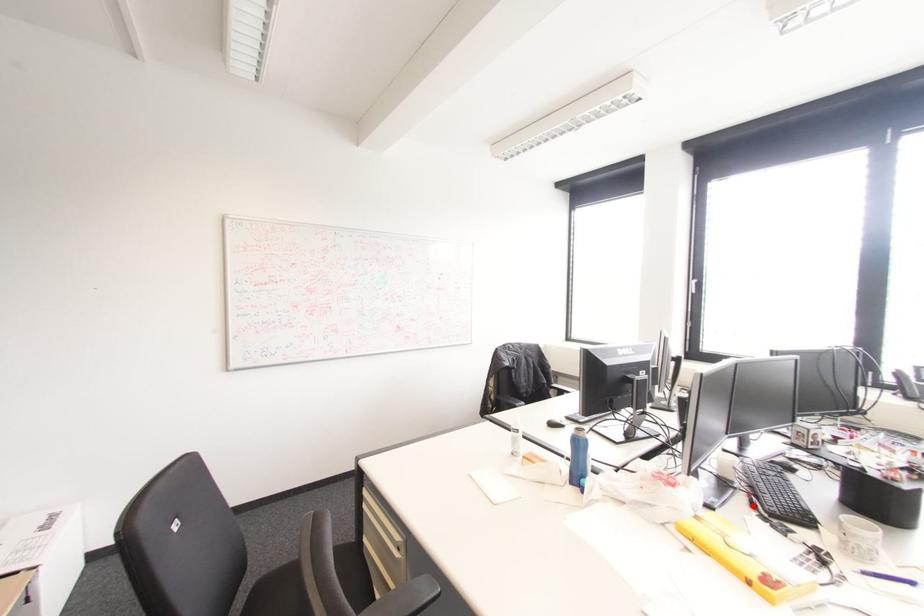
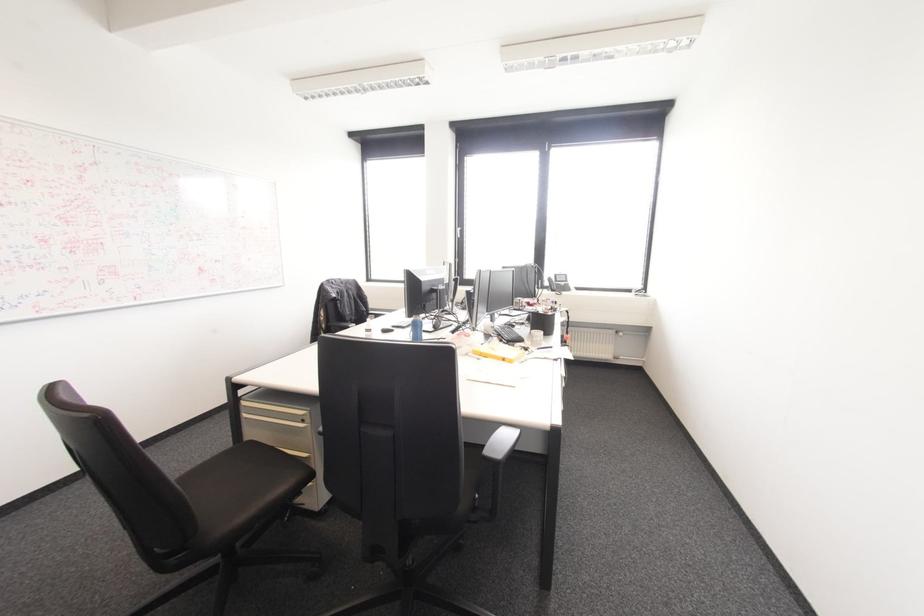
Find the pixel in the second image that matches the highlighted location in the first image.

(500, 339)